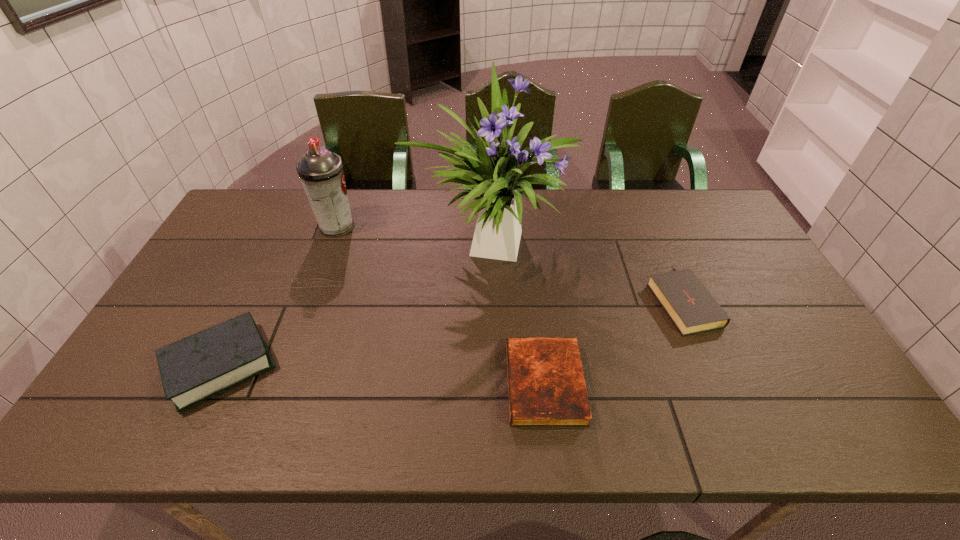
Where is `flower arrangement`? The height and width of the screenshot is (540, 960). flower arrangement is located at coordinates (493, 173).

I want to click on aerosol can, so click(320, 171).

The image size is (960, 540). I want to click on the third tallest object, so click(198, 367).

Where is `the tallest Bible`? The height and width of the screenshot is (540, 960). the tallest Bible is located at coordinates (198, 367).

Locate an element on the screen. the rightmost Bible is located at coordinates pyautogui.click(x=690, y=306).

The image size is (960, 540). Identify the location of the second Bible from left to right. (546, 388).

The image size is (960, 540). Find the location of `vacant area situated 0.180m on the left of the tallest object`. vacant area situated 0.180m on the left of the tallest object is located at coordinates (356, 244).

Locate an element on the screen. The image size is (960, 540). free space located on the right of the second tallest object is located at coordinates (420, 227).

This screenshot has height=540, width=960. I want to click on free region located 0.170m on the back of the leftmost Bible, so click(263, 279).

Where is `vacant area located 0.150m on the left of the rightmost Bible`? vacant area located 0.150m on the left of the rightmost Bible is located at coordinates (599, 300).